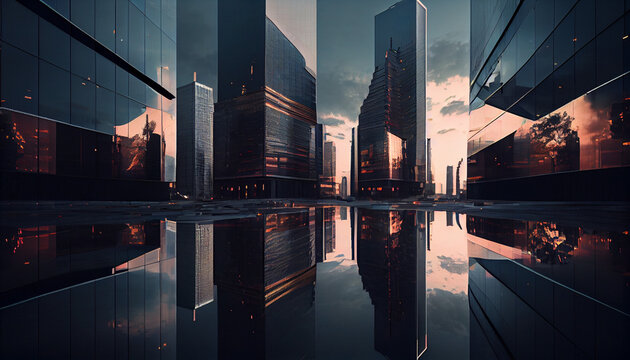
At what (x,y) coordinates should I click in order to perform the action: click on glass panel windows. Please return your answer as a coordinate pair (x, y). Image resolution: width=630 pixels, height=360 pixels. Looking at the image, I should click on (117, 115), (109, 114), (84, 106), (62, 98).